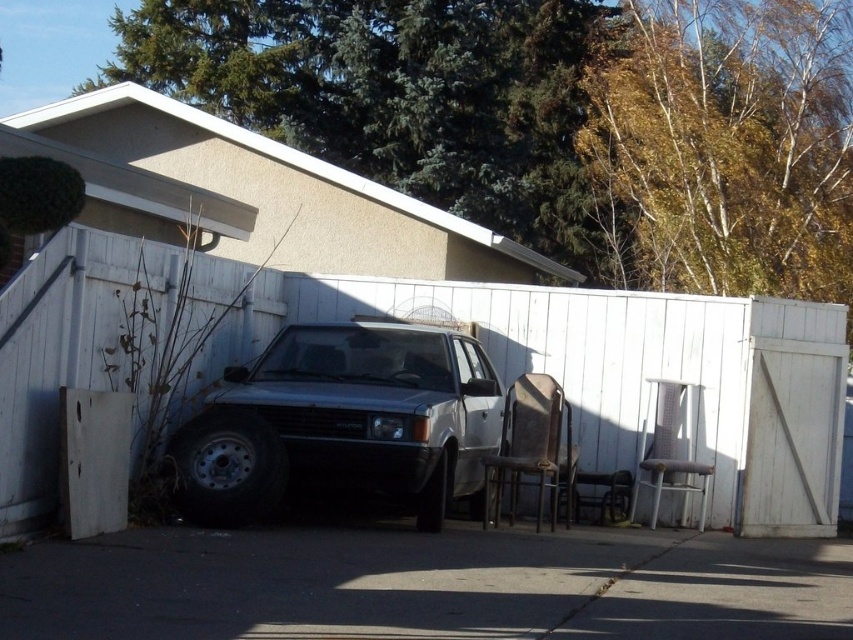
Question: Does dark asphalt driveway at center appear on the right side of satin silver car at center?

Choices:
 (A) yes
 (B) no

Answer: (B)

Question: Which of the following is the closest to the observer?

Choices:
 (A) (836, 636)
 (B) (490, 392)

Answer: (A)

Question: Which point is farther to the camera?

Choices:
 (A) satin silver car at center
 (B) dark asphalt driveway at center

Answer: (A)

Question: Can you confirm if dark asphalt driveway at center is bigger than satin silver car at center?

Choices:
 (A) no
 (B) yes

Answer: (A)

Question: Does dark asphalt driveway at center have a lesser width compared to satin silver car at center?

Choices:
 (A) no
 (B) yes

Answer: (B)